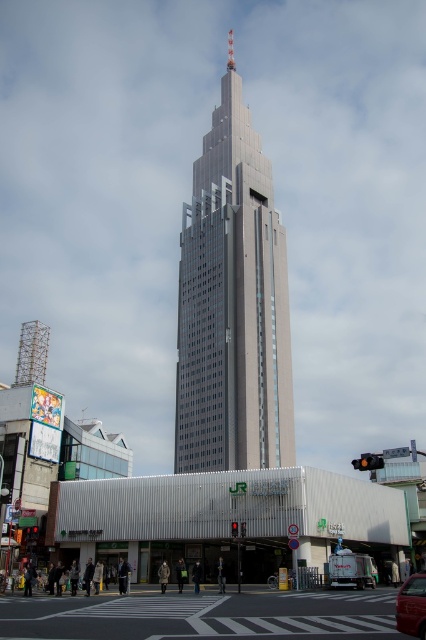
Question: Which point is farther to the camera?

Choices:
 (A) (290, 465)
 (B) (347, 624)

Answer: (A)

Question: Which point appears closest to the camera in this image?

Choices:
 (A) (198, 349)
 (B) (408, 577)
 (C) (233, 628)

Answer: (C)

Question: Is white asphalt at center thinner than red glossy car at lower right?

Choices:
 (A) no
 (B) yes

Answer: (A)

Question: Can you confirm if white asphalt at center is smaller than red glossy car at lower right?

Choices:
 (A) yes
 (B) no

Answer: (B)

Question: Can you confirm if white asphalt at center is positioned below red glossy car at lower right?

Choices:
 (A) yes
 (B) no

Answer: (A)

Question: Which point appears farthest from the camera in this image?

Choices:
 (A) (408, 620)
 (B) (213, 609)
 (C) (229, 156)

Answer: (C)